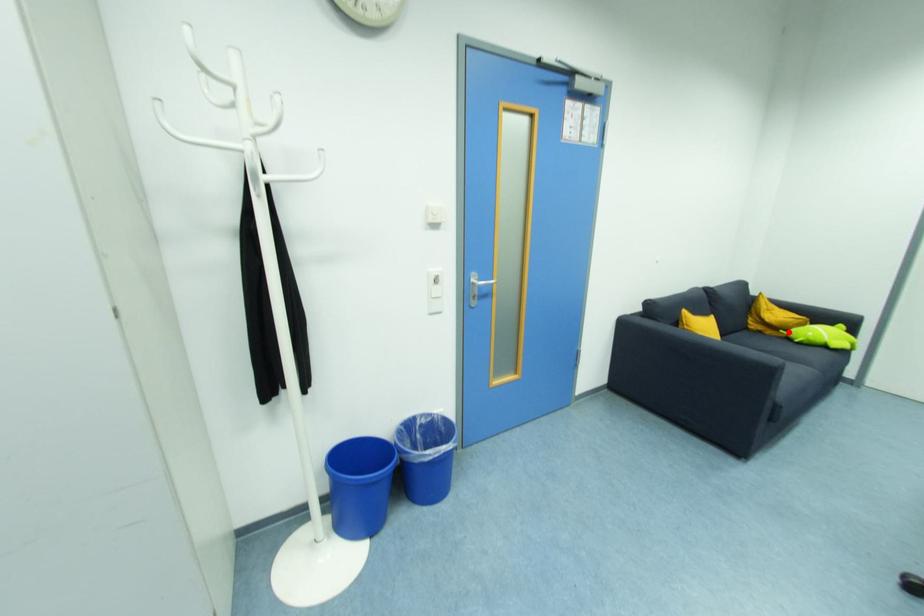
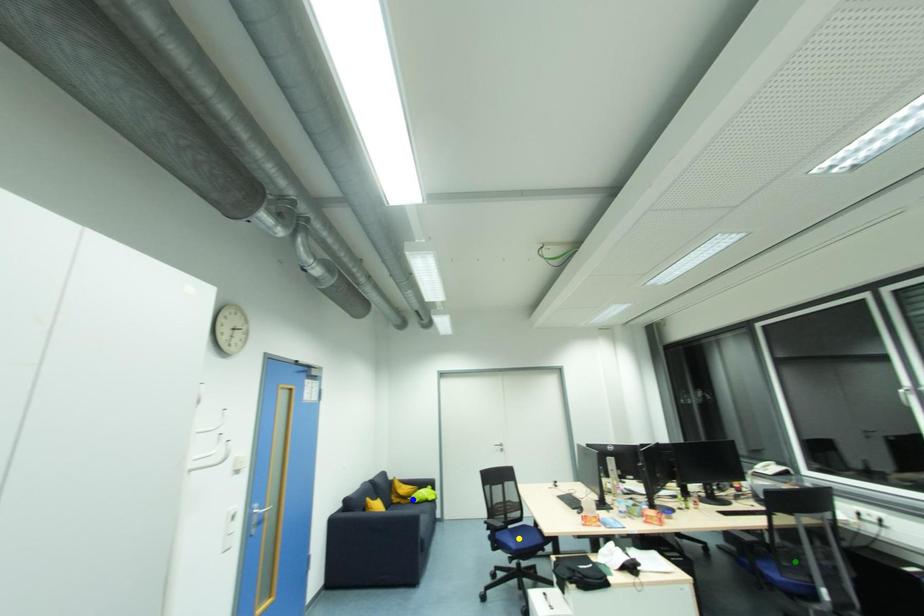
Question: I am providing you with two images of the same scene from different viewpoints. A red point is marked on the first image. You are given multiple points on the second image. Which point in image 2 is actually the same real-world point as the red point in image 1?

Choices:
 (A) yellow point
 (B) blue point
 (C) green point

Answer: (B)